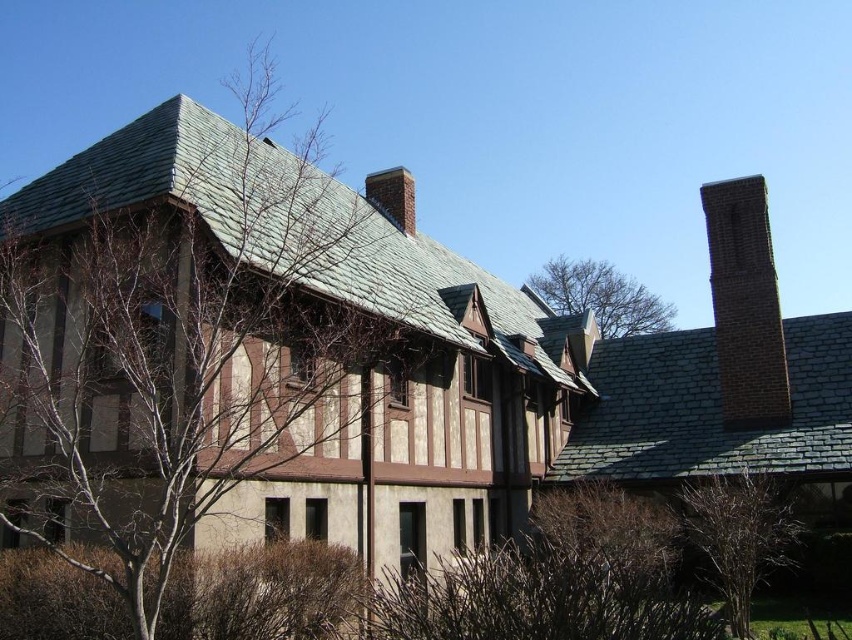
Question: Can you confirm if brick chimney at upper right is positioned above bare branches at upper center?

Choices:
 (A) no
 (B) yes

Answer: (A)

Question: Which object is farther from the camera taking this photo?

Choices:
 (A) brick chimney at upper right
 (B) bare branches at upper center

Answer: (B)

Question: Can you confirm if bare branches at left is positioned above bare branches at upper center?

Choices:
 (A) yes
 (B) no

Answer: (A)

Question: Which object appears farthest from the camera in this image?

Choices:
 (A) brick chimney at upper right
 (B) bare branches at upper center
 (C) bare branches at left
 (D) brown textured tree at lower right

Answer: (B)

Question: Which object is the closest to the brick chimney at upper right?

Choices:
 (A) bare branches at left
 (B) brown textured tree at lower right

Answer: (B)

Question: Is bare branches at left below brown textured tree at lower right?

Choices:
 (A) yes
 (B) no

Answer: (B)